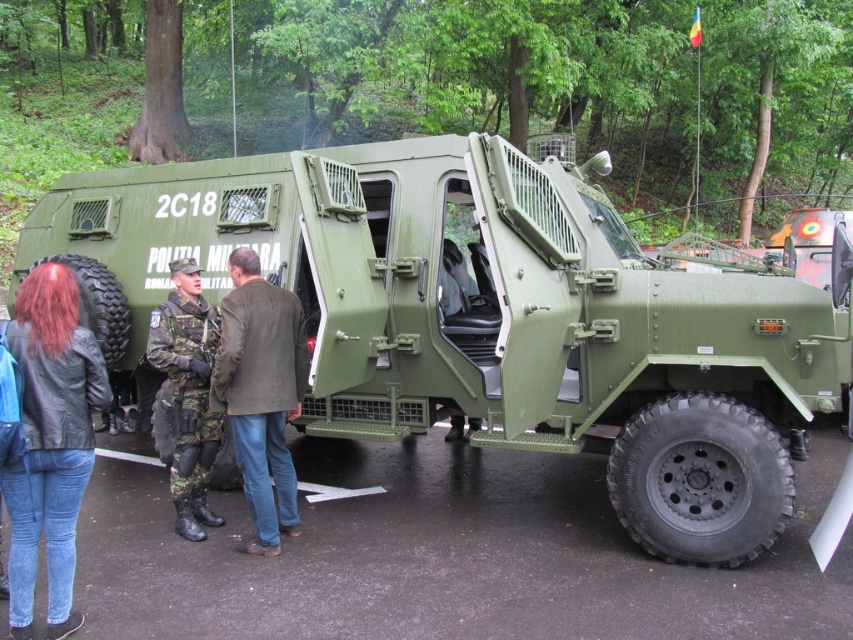
Question: Can you confirm if black leather jacket at lower left is bigger than camouflage fabric uniform at center?

Choices:
 (A) no
 (B) yes

Answer: (A)

Question: Based on their relative distances, which object is farther from the brown leather jacket at center?

Choices:
 (A) matte green armored vehicle at center
 (B) camouflage fabric uniform at center

Answer: (A)

Question: Which object is closer to the camera taking this photo?

Choices:
 (A) matte green armored vehicle at center
 (B) black leather jacket at lower left

Answer: (B)

Question: Does black leather jacket at lower left have a lesser width compared to brown leather jacket at center?

Choices:
 (A) yes
 (B) no

Answer: (A)

Question: Which object is the farthest from the brown leather jacket at center?

Choices:
 (A) camouflage fabric uniform at center
 (B) matte green armored vehicle at center
 (C) black leather jacket at lower left

Answer: (B)

Question: Is matte green armored vehicle at center smaller than camouflage fabric uniform at center?

Choices:
 (A) yes
 (B) no

Answer: (B)